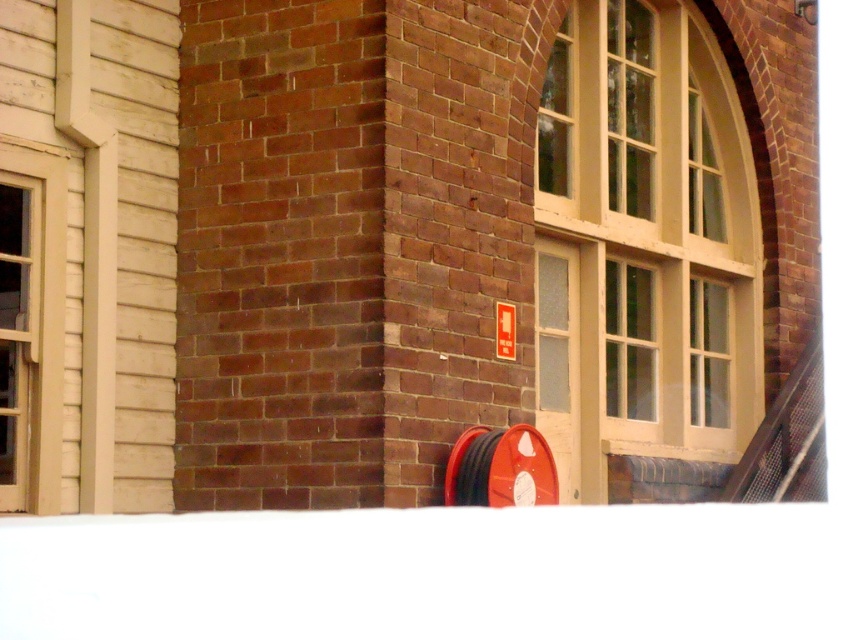
You are an architect designing a new building and want to ensure that the matte cream window at center and the metal mesh rail at lower right are proportionally balanced. Given their sizes, which object should be placed closer to the building entrance to maintain visual harmony?

The matte cream window at center is larger in size than the metal mesh rail at lower right, so to maintain visual harmony, the smaller metal mesh rail at lower right should be placed closer to the building entrance while the larger matte cream window at center can be positioned further away to balance their visual impact.

You are standing in front of the building and want to enter through one of the windows. Which window, the matte cream window at center or the matte beige window at left, is closer to you?

The matte cream window at center is closer to you because it is further to the viewer than the matte beige window at left.

You are a delivery person trying to locate the entrance to the building. You see the matte cream window at center and the metal mesh rail at lower right. Based on their positions, which object is closer to the entrance? Please explain your reasoning.

The matte cream window at center is positioned on the left side of the metal mesh rail at lower right. Since the entrance is typically located near the lower right area where the rail is placed, the metal mesh rail at lower right is closer to the entrance.